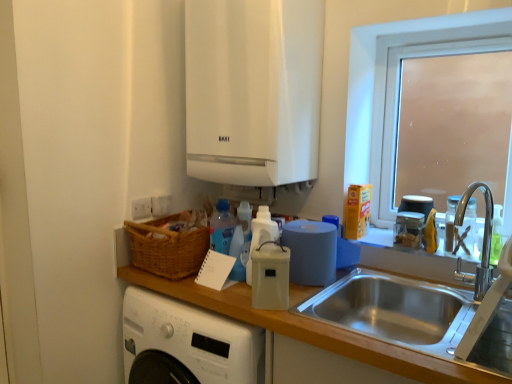
Question: In the image, is clear plastic container at upper right, the 2th appliance viewed from the front, positioned in front of or behind white plastic bottle at center, which is counted as the first bottle, starting from the left?

Choices:
 (A) front
 (B) behind

Answer: (B)

Question: From their relative heights in the image, would you say clear plastic container at upper right, which appears as the second appliance when viewed from the right, is taller or shorter than white plastic bottle at center, which is counted as the first bottle, starting from the left?

Choices:
 (A) tall
 (B) short

Answer: (B)

Question: Which object is the farthest from the wooden at left?

Choices:
 (A) beige plastic container at center, placed as the third appliance when sorted from right to left
 (B) white glossy boiler at upper center
 (C) frosted glass window at upper right
 (D) blue matte paper towel at right
 (E) clear glass bottle at right, which is the second bottle from left to right

Answer: (C)

Question: Which of these objects is positioned closest to the white glossy boiler at upper center?

Choices:
 (A) wooden at left
 (B) white plastic bottle at center, the second bottle in the right-to-left sequence
 (C) frosted glass window at upper right
 (D) translucent glass jar at upper right, arranged as the third appliance when viewed from the left
 (E) clear plastic container at upper right, which appears as the second appliance when viewed from the right

Answer: (C)